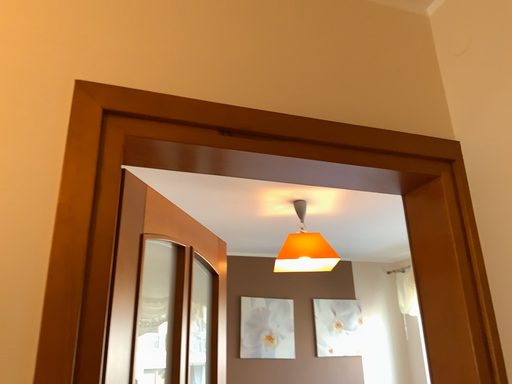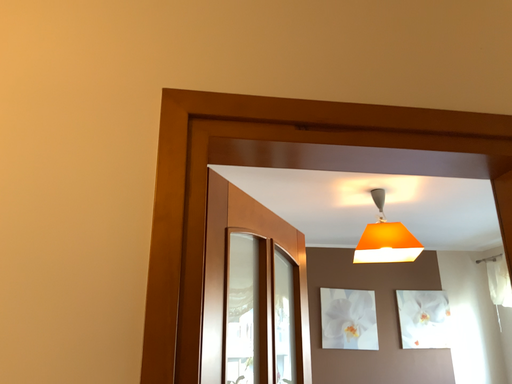
Question: Which way did the camera rotate in the video?

Choices:
 (A) rotated left
 (B) rotated right

Answer: (A)